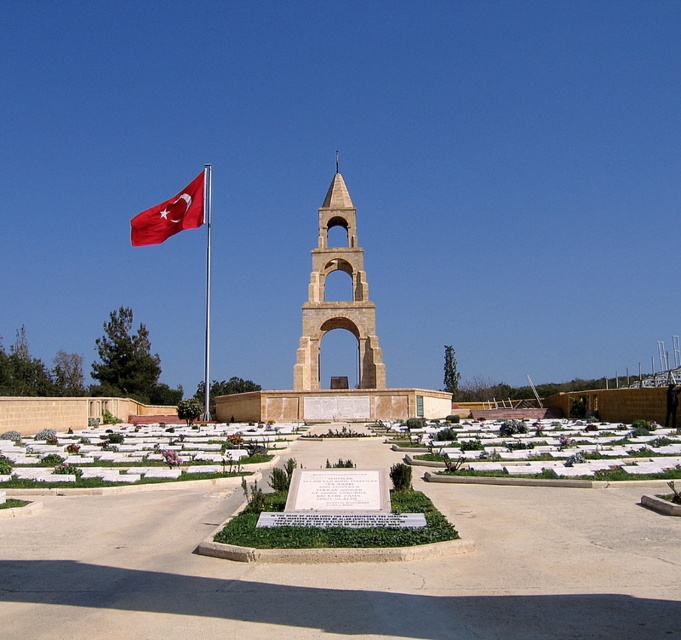
Which of these two, beige stone bell tower at center or metallic flag pole at left, stands taller?

With more height is metallic flag pole at left.

Is point (373, 342) closer to camera compared to point (204, 384)?

Yes.

The image size is (681, 640). Find the location of `beige stone bell tower at center`. beige stone bell tower at center is located at coordinates (336, 300).

Does point (144, 214) lie behind point (208, 195)?

No, (144, 214) is closer to viewer.

Looking at this image, between red fabric flag at left and metallic flag pole at left, which one has more height?

metallic flag pole at left

Image resolution: width=681 pixels, height=640 pixels. What do you see at coordinates (174, 212) in the screenshot?
I see `red fabric flag at left` at bounding box center [174, 212].

You are a GUI agent. You are given a task and a screenshot of the screen. Output one action in this format:
    pyautogui.click(x=<x>, y=<y>)
    Task: Click on the red fabric flag at left
    The width and height of the screenshot is (681, 640).
    Given the screenshot: What is the action you would take?
    pyautogui.click(x=174, y=212)

Does point (364, 371) lie in front of point (174, 196)?

Yes, it is in front of point (174, 196).

Identify the location of beige stone bell tower at center. The height and width of the screenshot is (640, 681). (336, 300).